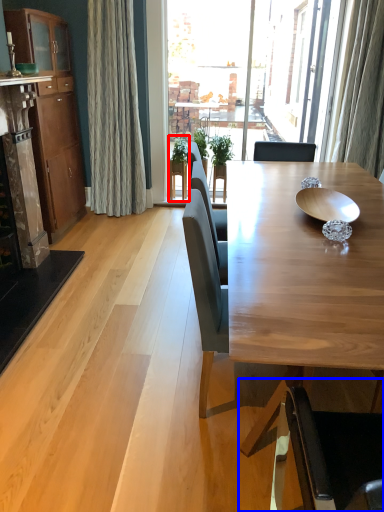
Question: Which object is further to the camera taking this photo, houseplant (highlighted by a red box) or chair (highlighted by a blue box)?

Choices:
 (A) houseplant
 (B) chair

Answer: (A)